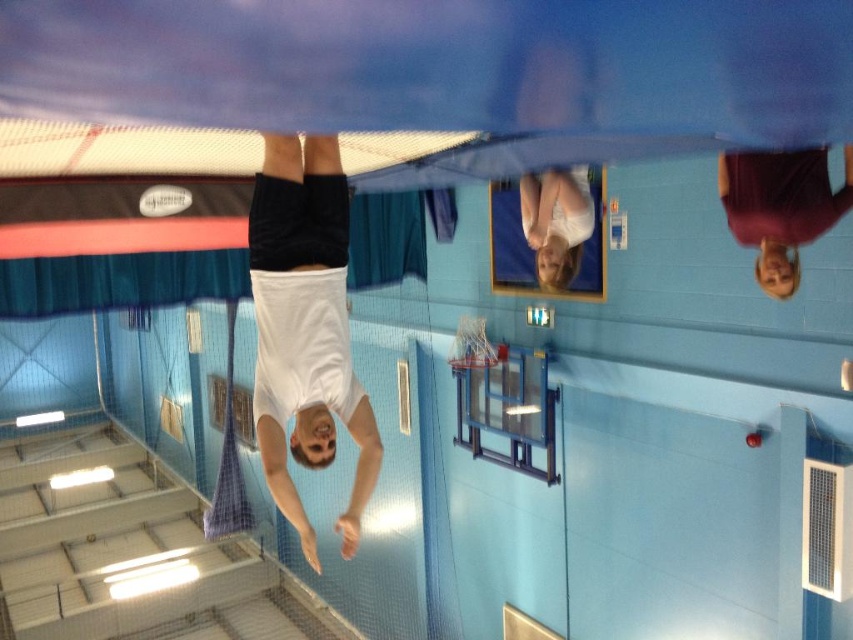
In the scene shown: Who is more distant from viewer, (756, 269) or (560, 227)?

The point (560, 227) is behind.

Is point (844, 172) closer to viewer compared to point (567, 198)?

Yes, it is.

Describe the element at coordinates (780, 208) in the screenshot. I see `maroon fabric shirt at upper right` at that location.

The image size is (853, 640). Identify the location of maroon fabric shirt at upper right. (780, 208).

Which is behind, point (326, 385) or point (547, 216)?

The point (547, 216) is more distant.

Can you confirm if white matte shirt at center is bigger than white fabric at upper center?

Yes, white matte shirt at center is bigger than white fabric at upper center.

Find the location of a particular element. The width and height of the screenshot is (853, 640). white matte shirt at center is located at coordinates (305, 326).

Where is `white matte shirt at center`? The height and width of the screenshot is (640, 853). white matte shirt at center is located at coordinates (305, 326).

Consider the image. Who is higher up, white matte shirt at center or maroon fabric shirt at upper right?

Positioned higher is maroon fabric shirt at upper right.

Where is `white matte shirt at center`? The height and width of the screenshot is (640, 853). white matte shirt at center is located at coordinates (305, 326).

Who is more distant from viewer, [289,346] or [735,221]?

The point [735,221] is behind.

Identify the location of white matte shirt at center. This screenshot has width=853, height=640. (305, 326).